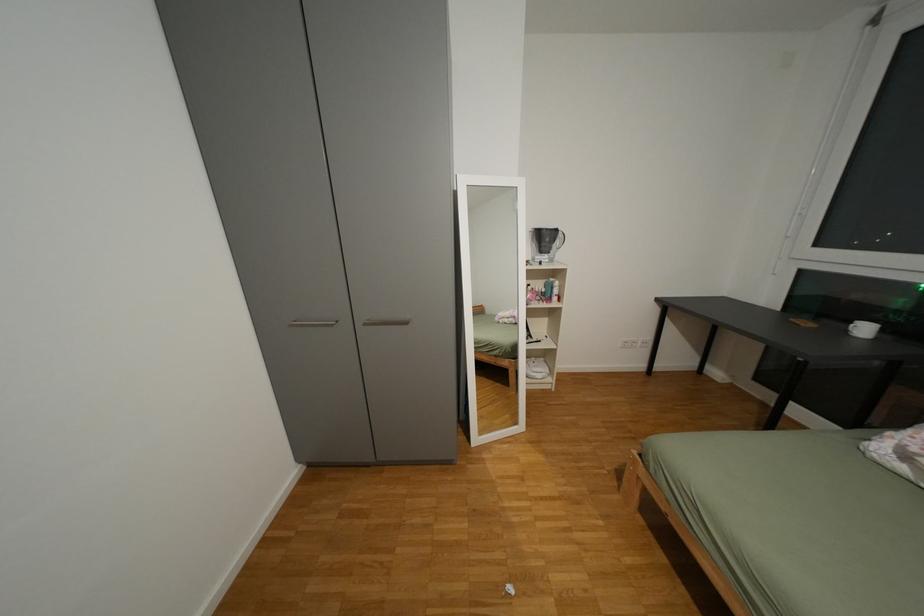
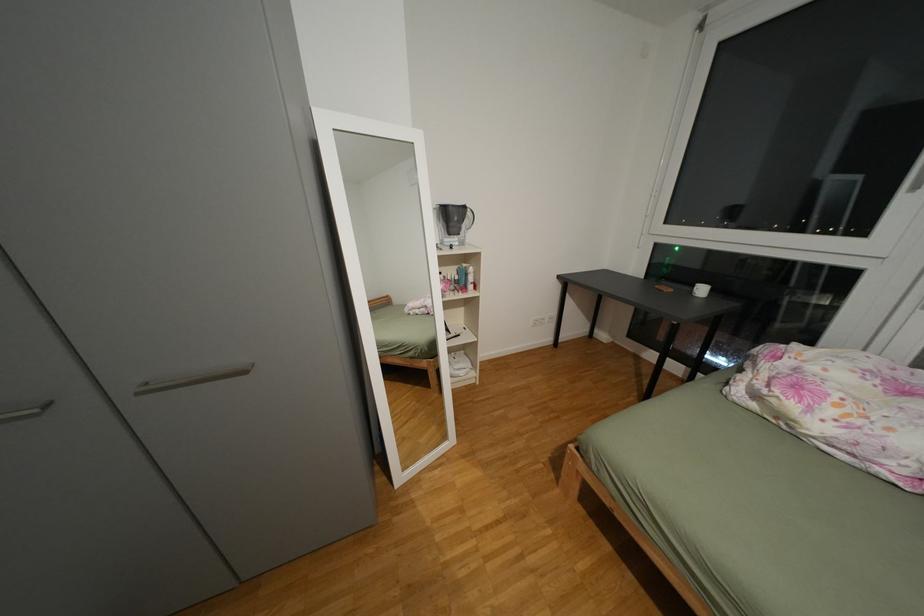
Question: The first image is from the beginning of the video and the second image is from the end. How did the camera likely rotate when shooting the video?

Choices:
 (A) Left
 (B) Right
 (C) Up
 (D) Down

Answer: (B)